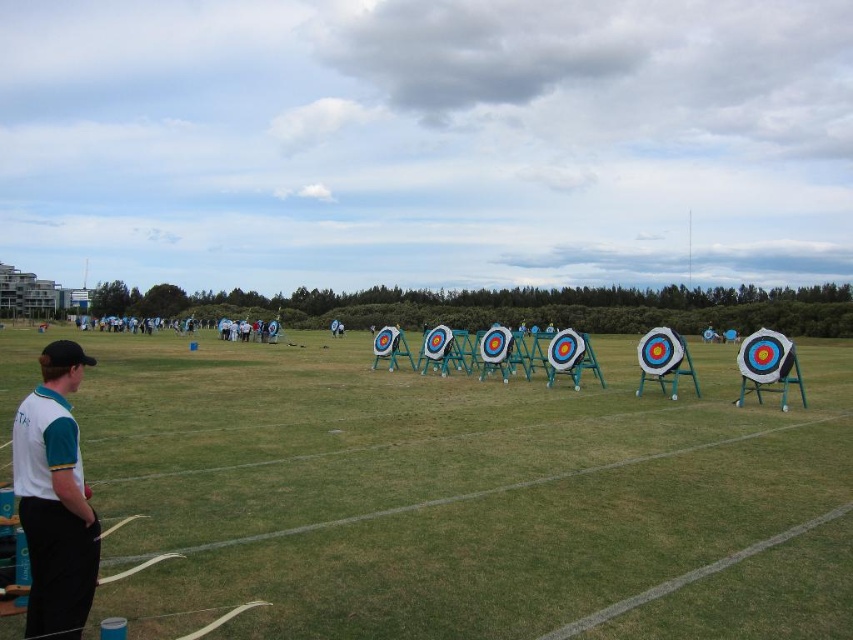
Can you confirm if white paper targets at center is positioned below white fabric shirt at lower left?

Yes, white paper targets at center is below white fabric shirt at lower left.

Where is `white paper targets at center`? The image size is (853, 640). white paper targets at center is located at coordinates (463, 497).

Identify the location of white paper targets at center. (463, 497).